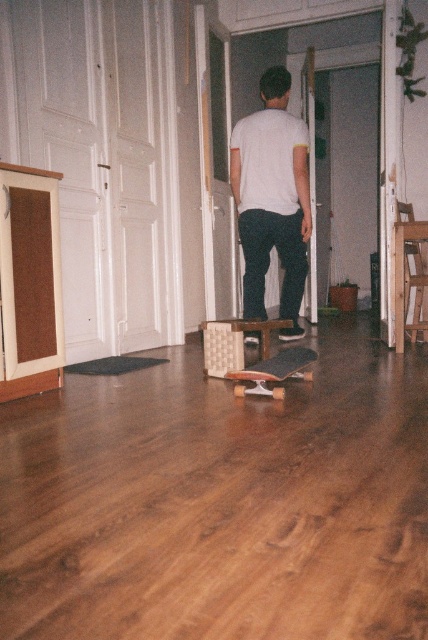
You are a photographer trying to capture the skateboarder. You want to ensure the wooden skateboard at center is visible in the photo. Given that the white matte shirt at upper center is in front of it, what adjustment should you make to your camera angle?

Since the wooden skateboard at center is behind the white matte shirt at upper center, you should adjust your camera angle to look past the white matte shirt at upper center so that the wooden skateboard at center becomes visible in the frame.

You are standing in the hallway and want to take a photo of both the point at coordinates (250, 168) and the point at coordinates (243, 381). Which point should you focus on first to ensure both are in focus?

To ensure both points are in focus, focus on the point at coordinates (243, 381) first since it is closer to you than the point at coordinates (250, 168), which is further away. This way, the depth of field will cover both points.